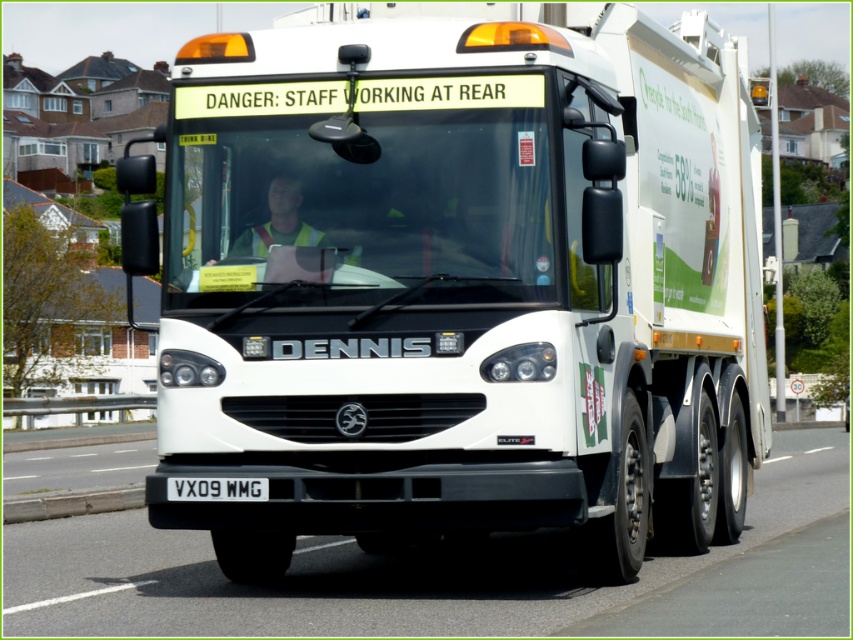
Question: Estimate the real-world distances between objects in this image. Which object is closer to the black metal/license plate at center?

Choices:
 (A) white matte truck at center
 (B) gray concrete curb at lower left

Answer: (A)

Question: Which of these objects is positioned closest to the gray concrete curb at lower left?

Choices:
 (A) white matte truck at center
 (B) black metal/license plate at center

Answer: (A)

Question: Does white matte truck at center have a larger size compared to black metal/license plate at center?

Choices:
 (A) no
 (B) yes

Answer: (B)

Question: Is white matte truck at center positioned behind gray concrete curb at lower left?

Choices:
 (A) no
 (B) yes

Answer: (A)

Question: In this image, where is white matte truck at center located relative to gray concrete curb at lower left?

Choices:
 (A) below
 (B) above

Answer: (B)

Question: Which point is closer to the camera?

Choices:
 (A) (218, 483)
 (B) (189, 408)

Answer: (A)